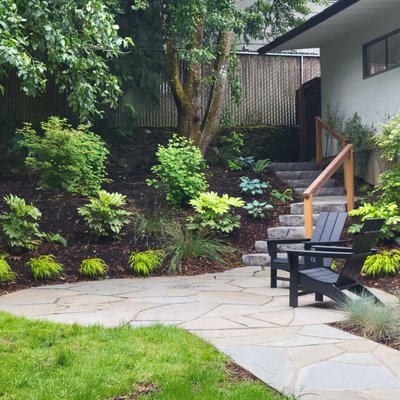
Locate an element on the screen. wood post for railing is located at coordinates [x=310, y=219], [x=348, y=183], [x=318, y=142].